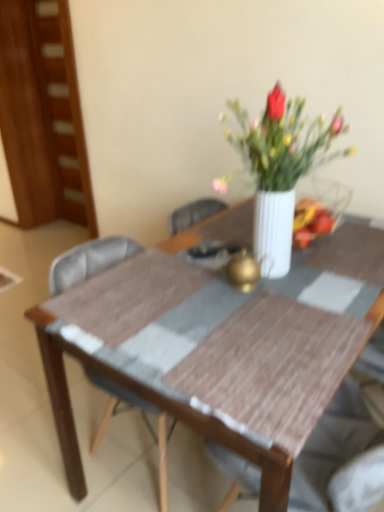
The image size is (384, 512). Describe the element at coordinates (222, 352) in the screenshot. I see `wooden table at center` at that location.

The height and width of the screenshot is (512, 384). Identify the location of wooden table at center. (222, 352).

Where is `wooden table at center`? wooden table at center is located at coordinates (222, 352).